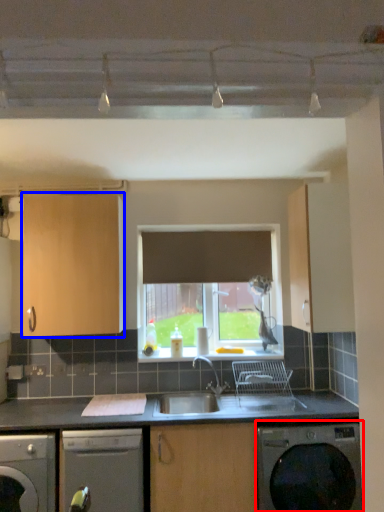
Question: Which of the following is the farthest to the observer, washing machine (highlighted by a red box) or cabinetry (highlighted by a blue box)?

Choices:
 (A) washing machine
 (B) cabinetry

Answer: (B)